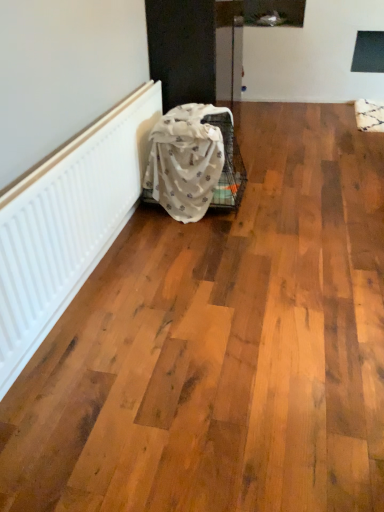
Locate an element on the screen. The width and height of the screenshot is (384, 512). white textured radiator at left is located at coordinates (68, 223).

The height and width of the screenshot is (512, 384). Describe the element at coordinates (68, 223) in the screenshot. I see `white textured radiator at left` at that location.

Measure the distance between white textured radiator at left and camera.

The depth of white textured radiator at left is 1.34 meters.

Describe the element at coordinates (188, 159) in the screenshot. Image resolution: width=384 pixels, height=512 pixels. I see `white textured fabric at lower left` at that location.

The image size is (384, 512). Identify the location of white textured fabric at lower left. (188, 159).

Locate an element on the screen. white textured radiator at left is located at coordinates (68, 223).

Considering the positions of objects white textured radiator at left and white textured fabric at lower left in the image provided, who is more to the right, white textured radiator at left or white textured fabric at lower left?

white textured fabric at lower left is more to the right.

Is white textured radiator at left in front of or behind white textured fabric at lower left in the image?

white textured radiator at left is in front of white textured fabric at lower left.

Is point (88, 186) farther from viewer compared to point (177, 188)?

No, it is not.

From the image's perspective, which one is positioned higher, white textured radiator at left or white textured fabric at lower left?

white textured fabric at lower left is shown above in the image.

From a real-world perspective, is white textured radiator at left on white textured fabric at lower left?

Yes, from a real-world perspective, white textured radiator at left is above white textured fabric at lower left.

Does white textured radiator at left have a lesser width compared to white textured fabric at lower left?

Yes.

Which of these two, white textured radiator at left or white textured fabric at lower left, stands shorter?

With less height is white textured radiator at left.

Looking at the image, does white textured radiator at left seem bigger or smaller compared to white textured fabric at lower left?

In the image, white textured radiator at left appears to be smaller than white textured fabric at lower left.

In the scene shown: Do you think white textured radiator at left is within white textured fabric at lower left, or outside of it?

white textured radiator at left cannot be found inside white textured fabric at lower left.

Based on the photo, is white textured radiator at left directly adjacent to white textured fabric at lower left?

No, white textured radiator at left is not next to white textured fabric at lower left.

Does white textured radiator at left turn towards white textured fabric at lower left?

Yes, white textured radiator at left is oriented towards white textured fabric at lower left.

How many degrees apart are the facing directions of white textured radiator at left and white textured fabric at lower left?

There is a 1.49-degree angle between the facing directions of white textured radiator at left and white textured fabric at lower left.

What are the coordinates of `blanket above the white textured radiator at left (from the image's perspective)` in the screenshot? It's located at (188, 159).

Between white textured fabric at lower left and white textured radiator at left, which one appears on the right side from the viewer's perspective?

white textured fabric at lower left.

Is white textured fabric at lower left in front of or behind white textured radiator at left in the image?

Clearly, white textured fabric at lower left is behind white textured radiator at left.

Does point (227, 167) appear closer or farther from the camera than point (112, 142)?

Point (227, 167) appears to be farther away from the viewer than point (112, 142).

From the image's perspective, does white textured fabric at lower left appear lower than white textured radiator at left?

Actually, white textured fabric at lower left appears above white textured radiator at left in the image.

From a real-world perspective, is white textured fabric at lower left positioned over white textured radiator at left based on gravity?

No, from a real-world perspective, white textured fabric at lower left is not over white textured radiator at left

Considering the sizes of objects white textured fabric at lower left and white textured radiator at left in the image provided, who is thinner, white textured fabric at lower left or white textured radiator at left?

With smaller width is white textured radiator at left.

Between white textured fabric at lower left and white textured radiator at left, which one has more height?

white textured fabric at lower left.

Is white textured fabric at lower left bigger or smaller than white textured radiator at left?

white textured fabric at lower left is bigger than white textured radiator at left.

Which is correct: white textured fabric at lower left is inside white textured radiator at left, or outside of it?

white textured fabric at lower left lies outside white textured radiator at left.

Are white textured fabric at lower left and white textured radiator at left located far from each other?

That's not correct — white textured fabric at lower left is a little close to white textured radiator at left.

Could you tell me if white textured fabric at lower left is facing white textured radiator at left?

No, white textured fabric at lower left is not aimed at white textured radiator at left.

How distant is white textured fabric at lower left from white textured radiator at left?

white textured fabric at lower left is 18.42 inches from white textured radiator at left.

The image size is (384, 512). In order to click on blanket that is on the right side of white textured radiator at left in this screenshot , I will do `click(188, 159)`.

Find the location of a particular element. The height and width of the screenshot is (512, 384). blanket lying behind the white textured radiator at left is located at coordinates (188, 159).

The width and height of the screenshot is (384, 512). In order to click on radiator above the white textured fabric at lower left (from a real-world perspective) in this screenshot , I will do `click(68, 223)`.